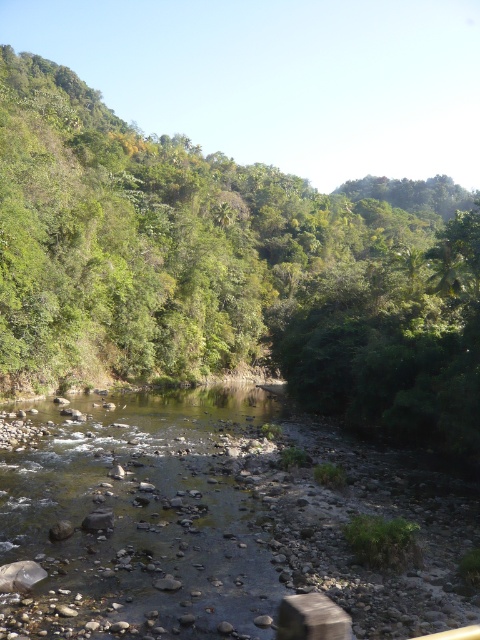
Based on the photo, can you confirm if green leafy tree at center is positioned to the left of clear water at center?

In fact, green leafy tree at center is to the right of clear water at center.

Between green leafy tree at center and clear water at center, which one has less height?

Standing shorter between the two is clear water at center.

Measure the distance between point (239, 240) and camera.

Point (239, 240) is 118.56 meters away from camera.

Locate an element on the screen. green leafy tree at center is located at coordinates (230, 266).